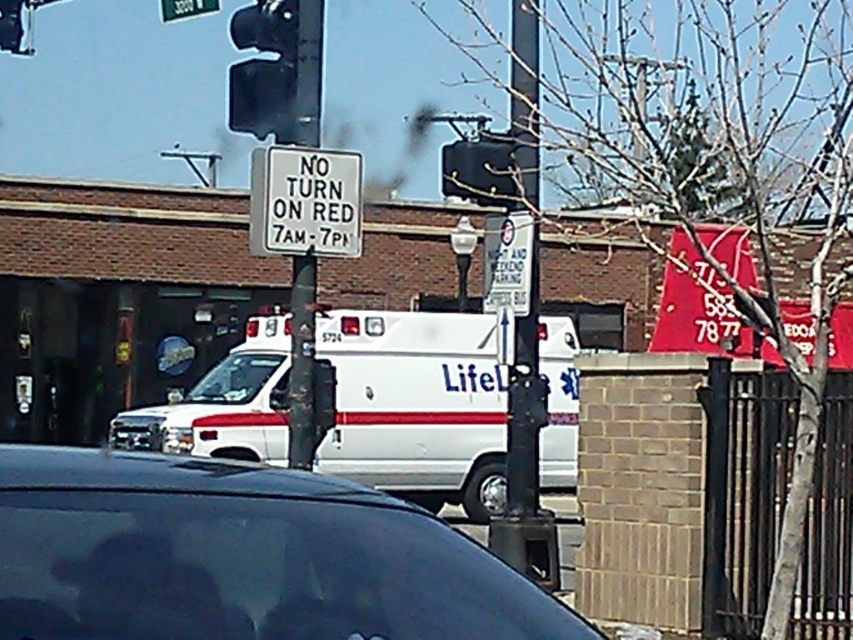
Does white plastic sign at upper center have a larger size compared to green metallic street sign at upper center?

No, white plastic sign at upper center is not bigger than green metallic street sign at upper center.

Describe the element at coordinates (312, 202) in the screenshot. I see `white plastic sign at upper center` at that location.

In order to click on white plastic sign at upper center in this screenshot , I will do (312, 202).

Does white plastic sign at center have a smaller size compared to green metallic street sign at upper center?

Correct, white plastic sign at center occupies less space than green metallic street sign at upper center.

Looking at this image, is white plastic sign at center bigger than green metallic street sign at upper center?

No, white plastic sign at center is not bigger than green metallic street sign at upper center.

At what (x,y) coordinates should I click in order to perform the action: click on white plastic sign at center. Please return your answer as a coordinate pair (x, y). The width and height of the screenshot is (853, 640). Looking at the image, I should click on (508, 262).

Does point (540, 509) come closer to viewer compared to point (271, 84)?

That is False.

Which is in front, point (527, 316) or point (279, 74)?

Positioned in front is point (279, 74).

The width and height of the screenshot is (853, 640). What are the coordinates of `black metal pole at center` in the screenshot? It's located at (525, 340).